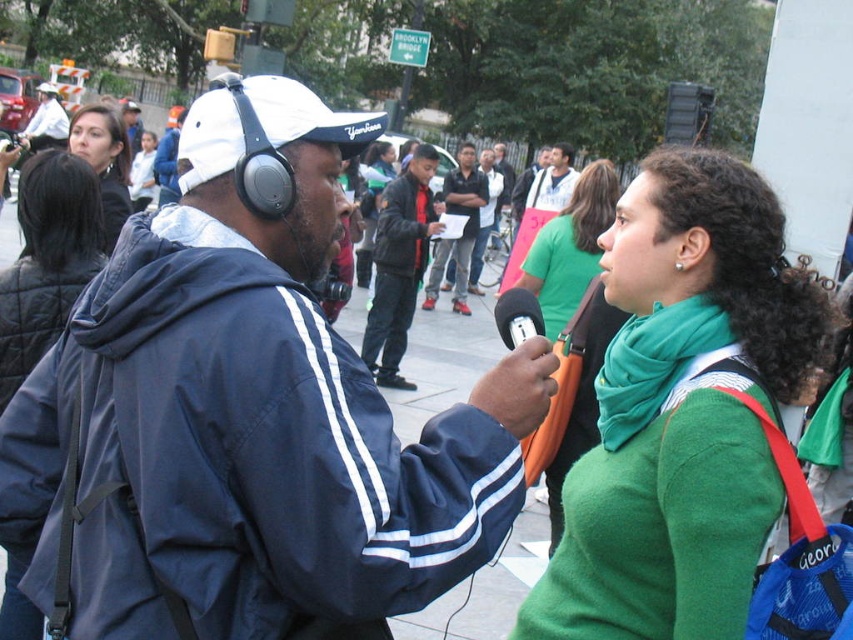
Measure the distance between black quilted jacket at left and camera.

A distance of 9.40 feet exists between black quilted jacket at left and camera.

Does point (53, 172) come behind point (566, 154)?

No, (53, 172) is closer to viewer.

Who is more forward, [79,225] or [544,209]?

Point [79,225]

Identify the location of black quilted jacket at left. (47, 259).

Between point (793, 337) and point (129, 99), which one is positioned in front?

Positioned in front is point (793, 337).

Between green fuzzy sweater at center and matte black headphones at upper left, which one appears on the left side from the viewer's perspective?

matte black headphones at upper left

Is point (578, 531) closer to viewer compared to point (136, 131)?

Yes, point (578, 531) is closer to viewer.

Where is `green fuzzy sweater at center`? This screenshot has height=640, width=853. green fuzzy sweater at center is located at coordinates (683, 410).

The height and width of the screenshot is (640, 853). I want to click on green soft scarf at right, so 653,364.

Can you confirm if green soft scarf at right is wider than dark blue jeans at center?

In fact, green soft scarf at right might be narrower than dark blue jeans at center.

Is point (662, 308) positioned behind point (433, 300)?

No.

This screenshot has width=853, height=640. I want to click on green soft scarf at right, so click(x=653, y=364).